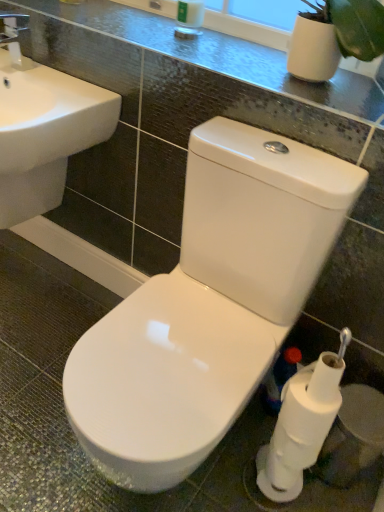
Question: From the image's perspective, is white matte toilet paper at lower right, the 1th toilet paper viewed from the top, located beneath white glossy toilet at center?

Choices:
 (A) no
 (B) yes

Answer: (B)

Question: Is white matte toilet paper at lower right, the 1th toilet paper viewed from the top, at the left side of white glossy toilet at center?

Choices:
 (A) yes
 (B) no

Answer: (B)

Question: Is white matte toilet paper at lower right, the 1th toilet paper viewed from the top, aimed at white glossy toilet at center?

Choices:
 (A) yes
 (B) no

Answer: (A)

Question: Is white matte toilet paper at lower right, the 1th toilet paper viewed from the top, positioned behind white glossy toilet at center?

Choices:
 (A) no
 (B) yes

Answer: (B)

Question: From a real-world perspective, is white matte toilet paper at lower right, the 2th toilet paper positioned from the bottom, on white glossy toilet at center?

Choices:
 (A) yes
 (B) no

Answer: (B)

Question: From a real-world perspective, is white matte toilet paper at lower right, the 1th toilet paper viewed from the top, located beneath white glossy toilet at center?

Choices:
 (A) no
 (B) yes

Answer: (B)

Question: From a real-world perspective, is white matte toilet paper at lower right, which is counted as the 1th toilet paper, starting from the bottom, under glossy ceramic counter top at upper center?

Choices:
 (A) no
 (B) yes

Answer: (B)

Question: Is white matte toilet paper at lower right, which is counted as the second toilet paper, starting from the top, surrounding glossy ceramic counter top at upper center?

Choices:
 (A) no
 (B) yes

Answer: (A)

Question: Is white matte toilet paper at lower right, which is counted as the 1th toilet paper, starting from the bottom, bigger than glossy ceramic counter top at upper center?

Choices:
 (A) yes
 (B) no

Answer: (B)

Question: Is white matte toilet paper at lower right, which is counted as the second toilet paper, starting from the top, positioned with its back to glossy ceramic counter top at upper center?

Choices:
 (A) yes
 (B) no

Answer: (B)

Question: Is white matte toilet paper at lower right, which is counted as the 1th toilet paper, starting from the bottom, to the left of glossy ceramic counter top at upper center from the viewer's perspective?

Choices:
 (A) no
 (B) yes

Answer: (A)

Question: Would you say white matte toilet paper at lower right, the 2th toilet paper positioned from the bottom, is part of white matte toilet paper at lower right, which is counted as the second toilet paper, starting from the top,'s contents?

Choices:
 (A) yes
 (B) no

Answer: (B)